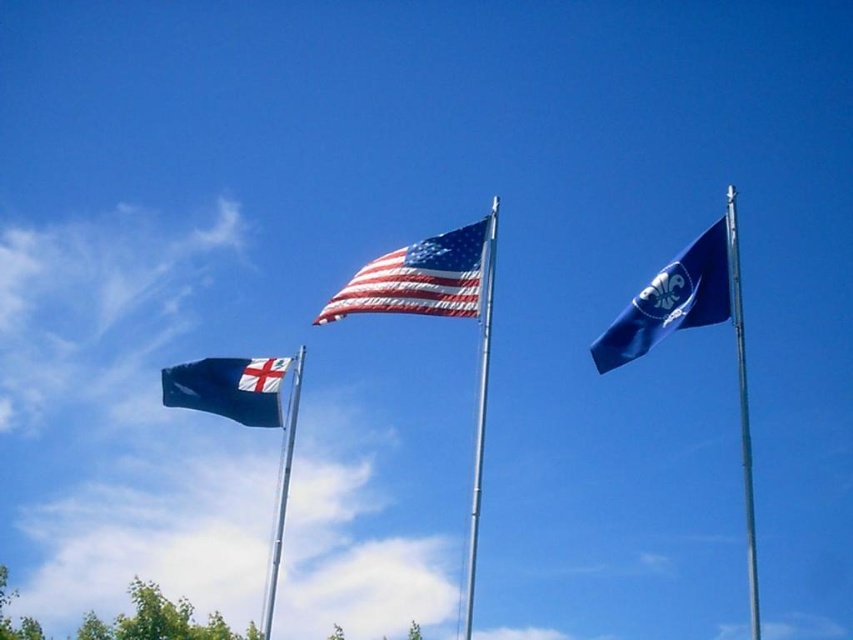
Question: Which point appears closest to the camera in this image?

Choices:
 (A) (744, 484)
 (B) (469, 554)
 (C) (670, 289)
 (D) (270, 556)

Answer: (C)

Question: Is american flag at center positioned at the back of blue fabric flag at upper right?

Choices:
 (A) no
 (B) yes

Answer: (B)

Question: Which is nearer to the blue fabric flag at left?

Choices:
 (A) silver metallic flag pole at center
 (B) blue metallic flag pole at center
 (C) blue fabric flag at upper right
 (D) metallic silver flag pole at right

Answer: (B)

Question: Does blue fabric flag at left appear under silver metallic flag pole at center?

Choices:
 (A) no
 (B) yes

Answer: (A)

Question: Can you confirm if american flag at center is smaller than blue fabric flag at left?

Choices:
 (A) no
 (B) yes

Answer: (B)

Question: Among these points, which one is farthest from the camera?

Choices:
 (A) (297, 410)
 (B) (276, 380)

Answer: (A)